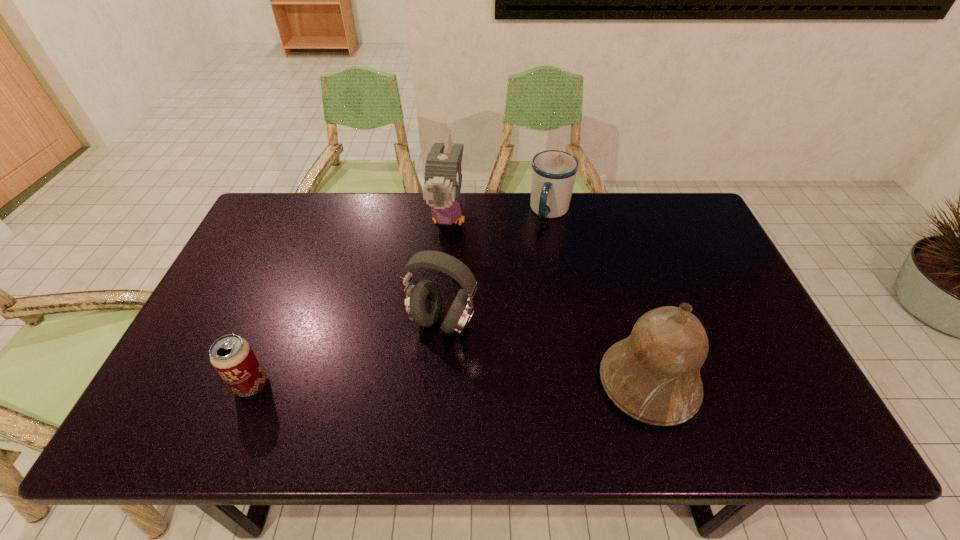
At what (x,y) coordinates should I click in order to perform the action: click on vacant space that's between the mug and the headset. Please return your answer as a coordinate pair (x, y). Looking at the image, I should click on (496, 267).

At what (x,y) coordinates should I click in order to perform the action: click on blank region between the beer can and the mug. Please return your answer as a coordinate pair (x, y). This screenshot has height=540, width=960. Looking at the image, I should click on (401, 298).

Where is `free space between the bird and the bell`? This screenshot has height=540, width=960. free space between the bird and the bell is located at coordinates (548, 301).

Find the location of `free space between the mug and the bird`. free space between the mug and the bird is located at coordinates (499, 215).

Find the location of `free space between the headset and the leftmost object`. free space between the headset and the leftmost object is located at coordinates (348, 354).

You are a GUI agent. You are given a task and a screenshot of the screen. Output one action in this format:
    pyautogui.click(x=<x>, y=<y>)
    Task: Click on the free space between the bird and the bell
    Image resolution: width=960 pixels, height=540 pixels.
    Given the screenshot: What is the action you would take?
    pyautogui.click(x=548, y=301)

In order to click on vacant space that is in between the bird and the mug in this screenshot , I will do `click(499, 215)`.

This screenshot has height=540, width=960. I want to click on object identified as the closest to the bell, so click(x=423, y=302).

Locate which object is the closest to the headset. Please provide its 2D coordinates. Your answer should be formatted as a tuple, i.e. [(x, y)], where the tuple contains the x and y coordinates of a point satisfying the conditions above.

[(443, 178)]

The width and height of the screenshot is (960, 540). I want to click on free location that satisfies the following two spatial constraints: 1. on the back side of the headset; 2. on the right side of the mug, so click(x=451, y=212).